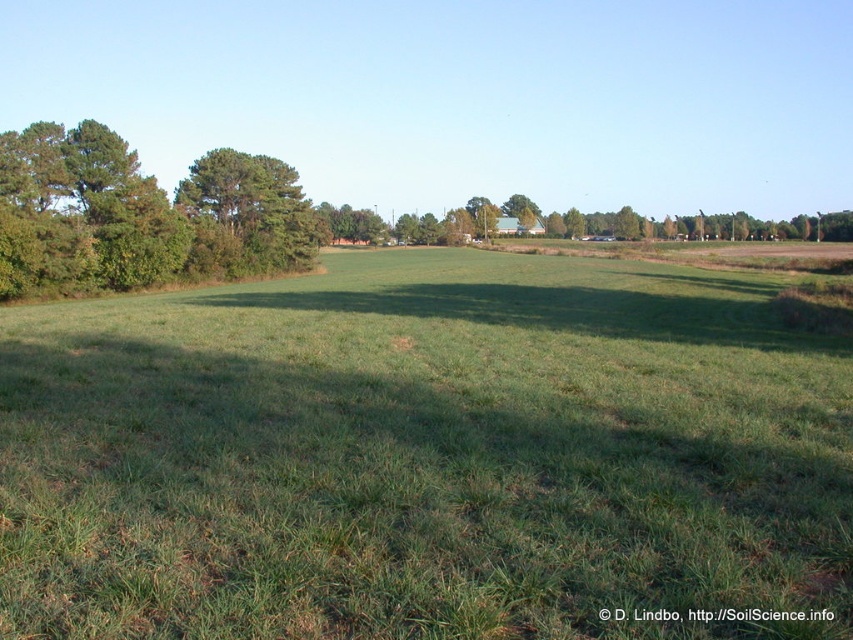
Question: From the image, what is the correct spatial relationship of green grass at center in relation to green leafy trees at left?

Choices:
 (A) below
 (B) above

Answer: (A)

Question: Which point appears closest to the camera in this image?

Choices:
 (A) (6, 486)
 (B) (115, 272)

Answer: (A)

Question: Does green grass at center have a greater width compared to green leafy trees at left?

Choices:
 (A) yes
 (B) no

Answer: (A)

Question: Which object appears farthest from the camera in this image?

Choices:
 (A) green grass at center
 (B) green leafy trees at left

Answer: (B)

Question: Which point is closer to the camera?

Choices:
 (A) (6, 230)
 (B) (383, 392)

Answer: (B)

Question: Is green grass at center smaller than green leafy trees at left?

Choices:
 (A) yes
 (B) no

Answer: (A)